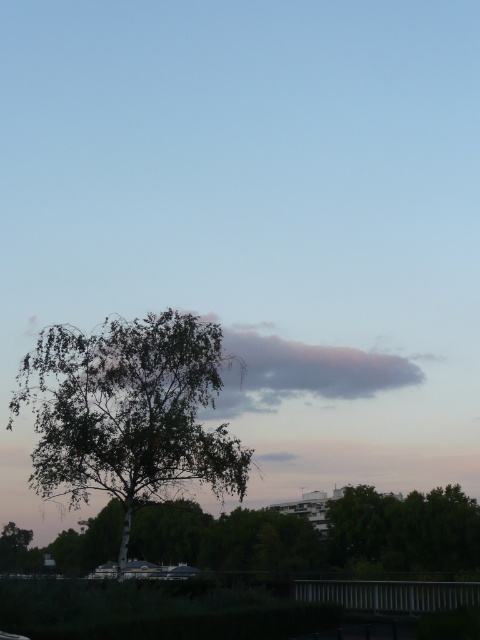
You are standing at the center of the image and want to walk towards the green leafy tree at center. In which direction should you move?

The green leafy tree at center is located at point coordinates of 0.645 on the x axis and 0.269 on the y axis. Since you are at the center of the image, which is point 0.5 on both axes, you should move to the right and slightly upward to reach the green leafy tree at center.

You are an artist planning to sketch the two green leafy trees in the scene. The green leafy tree at center and the green leafy tree at lower center. Which tree should you focus on to capture more details due to its size?

The green leafy tree at lower center should be focused on because it occupies more space than the green leafy tree at center, allowing for more detailed sketching.

You are standing in the serene outdoor scene and want to take a photo of both the green leafy tree at center and the green leafy tree at lower center. Which tree should you focus on first if you want to capture them both in the same frame without moving your camera?

The green leafy tree at lower center is positioned lower than the green leafy tree at center. To capture both in the same frame, focus on the lower one first and adjust the camera angle to include the upper tree as well.